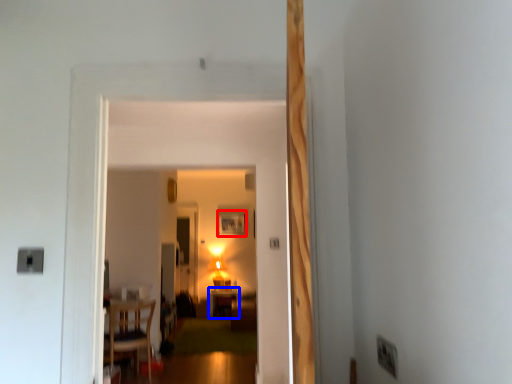
Question: Which of the following is the farthest to the observer, picture frame (highlighted by a red box) or table (highlighted by a blue box)?

Choices:
 (A) picture frame
 (B) table

Answer: (A)